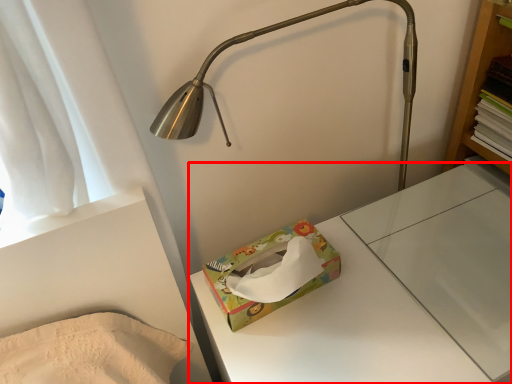
Question: Considering the relative positions of changing table (annotated by the red box) and package in the image provided, where is changing table (annotated by the red box) located with respect to the staircase?

Choices:
 (A) right
 (B) left

Answer: (A)